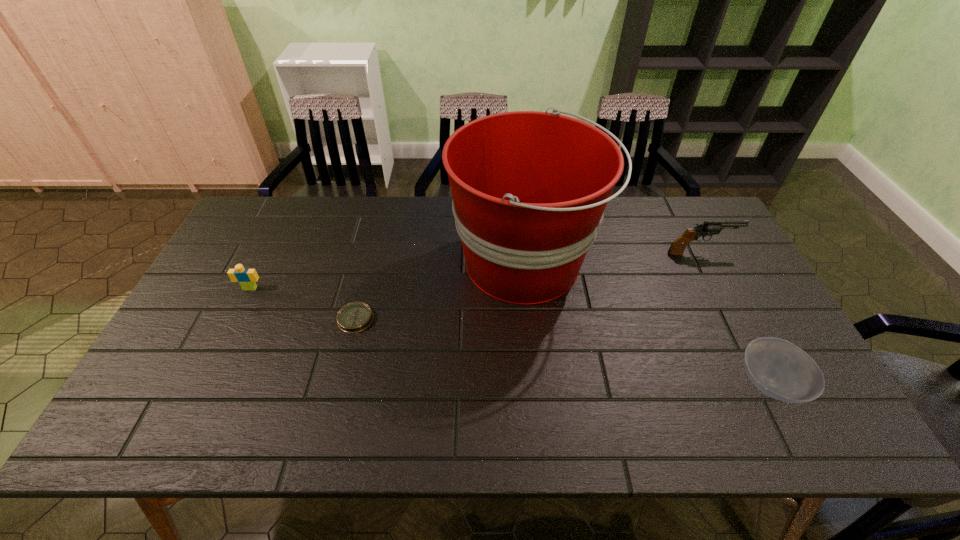
This screenshot has width=960, height=540. I want to click on unoccupied position between the nearest object and the second object from left to right, so click(x=563, y=352).

Identify which object is located as the second nearest to the third shortest object. Please provide its 2D coordinates. Your answer should be formatted as a tuple, i.e. [(x, y)], where the tuple contains the x and y coordinates of a point satisfying the conditions above.

[(529, 188)]

Identify the location of object that stands as the fourth closest to the shortest object. This screenshot has height=540, width=960. (781, 370).

This screenshot has width=960, height=540. I want to click on free space that satisfies the following two spatial constraints: 1. along the barrel of the fourth shortest object; 2. on the front side of the bucket, so click(707, 264).

Locate an element on the screen. The image size is (960, 540). vacant space that satisfies the following two spatial constraints: 1. on the front side of the fourth object from right to left; 2. on the right side of the bowl is located at coordinates (339, 384).

Locate an element on the screen. Image resolution: width=960 pixels, height=540 pixels. vacant space that satisfies the following two spatial constraints: 1. along the barrel of the fourth shortest object; 2. on the front side of the second object from left to right is located at coordinates (734, 319).

Locate an element on the screen. The width and height of the screenshot is (960, 540). free spot that satisfies the following two spatial constraints: 1. on the face of the fourth object from right to left; 2. on the right side of the third tallest object is located at coordinates (235, 319).

The height and width of the screenshot is (540, 960). Identify the location of vacant region that satisfies the following two spatial constraints: 1. along the barrel of the gun; 2. on the front side of the shortest object. (734, 319).